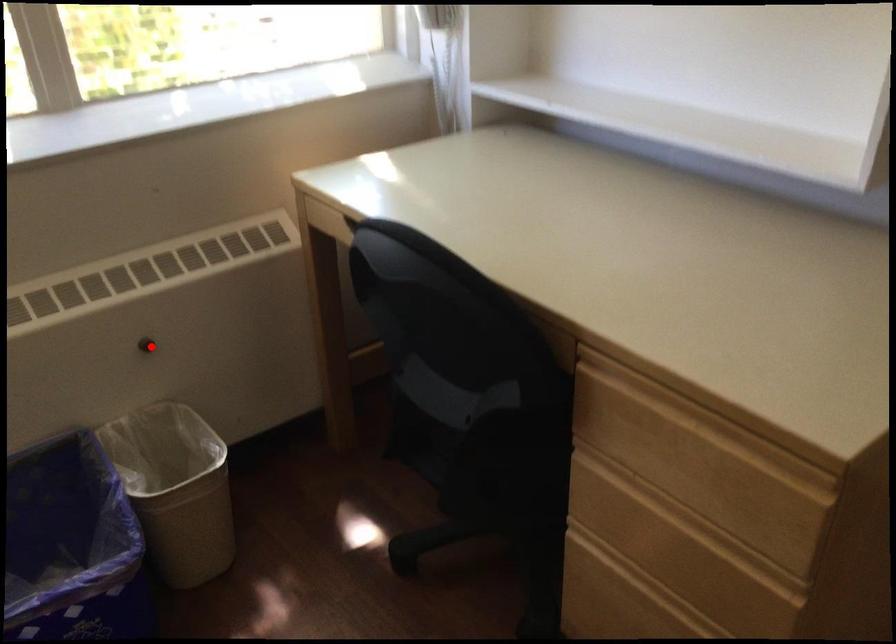
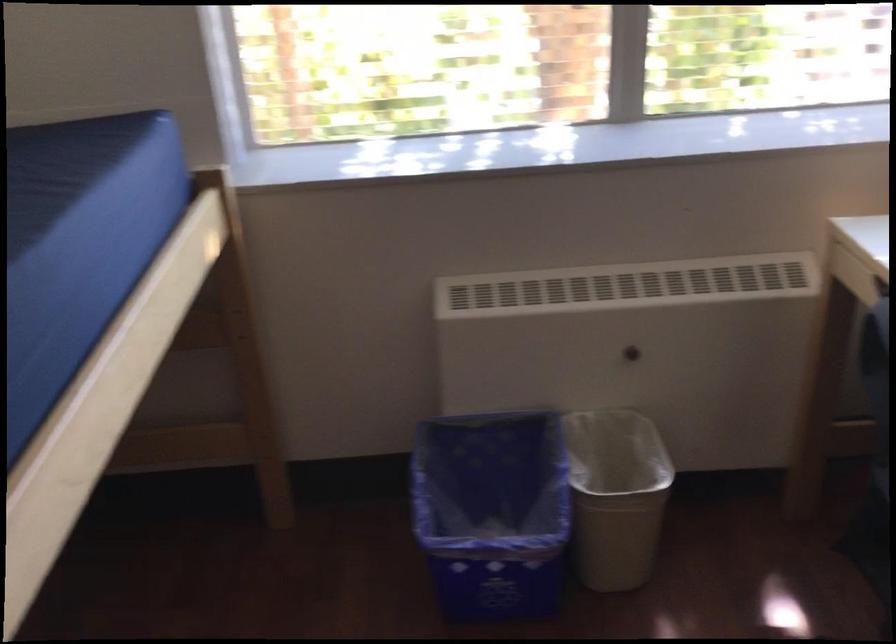
Locate, in the second image, the point that corresponds to the highlighted location in the first image.

(634, 351)